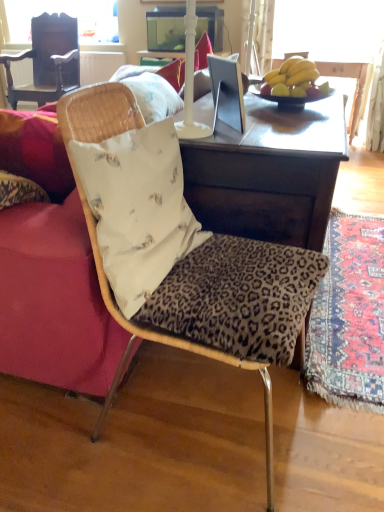
Question: Should I look upward or downward to see wooden desk at center?

Choices:
 (A) down
 (B) up

Answer: (B)

Question: Is the depth of yellow matte bananas at upper right greater than that of dark wood chair at upper left, arranged as the 2th chair when ordered from the bottom?

Choices:
 (A) no
 (B) yes

Answer: (A)

Question: From a real-world perspective, is yellow matte bananas at upper right located beneath dark wood chair at upper left, the first chair from the back?

Choices:
 (A) no
 (B) yes

Answer: (A)

Question: Does yellow matte bananas at upper right appear on the left side of dark wood chair at upper left, the second chair in the right-to-left sequence?

Choices:
 (A) yes
 (B) no

Answer: (B)

Question: Is yellow matte bananas at upper right positioned in front of dark wood chair at upper left, which appears as the first chair when viewed from the top?

Choices:
 (A) yes
 (B) no

Answer: (A)

Question: From the image's perspective, is yellow matte bananas at upper right on dark wood chair at upper left, marked as the 2th chair in a front-to-back arrangement?

Choices:
 (A) no
 (B) yes

Answer: (A)

Question: Does yellow matte bananas at upper right have a greater height compared to dark wood chair at upper left, marked as the 2th chair in a front-to-back arrangement?

Choices:
 (A) yes
 (B) no

Answer: (B)

Question: Is white fabric pillow at center thinner than yellow matte bananas at upper right?

Choices:
 (A) no
 (B) yes

Answer: (B)

Question: Would you say white fabric pillow at center is outside yellow matte bananas at upper right?

Choices:
 (A) yes
 (B) no

Answer: (A)

Question: Considering the relative sizes of white fabric pillow at center and yellow matte bananas at upper right in the image provided, is white fabric pillow at center smaller than yellow matte bananas at upper right?

Choices:
 (A) yes
 (B) no

Answer: (B)

Question: From a real-world perspective, is white fabric pillow at center physically above yellow matte bananas at upper right?

Choices:
 (A) no
 (B) yes

Answer: (A)

Question: Is white fabric pillow at center bigger than yellow matte bananas at upper right?

Choices:
 (A) no
 (B) yes

Answer: (B)

Question: From a real-world perspective, is white fabric pillow at center physically below yellow matte bananas at upper right?

Choices:
 (A) yes
 (B) no

Answer: (A)

Question: Can you confirm if velvet red couch at left is positioned to the left of leopard print fabric chair at center, marked as the second chair in a left-to-right arrangement?

Choices:
 (A) yes
 (B) no

Answer: (A)